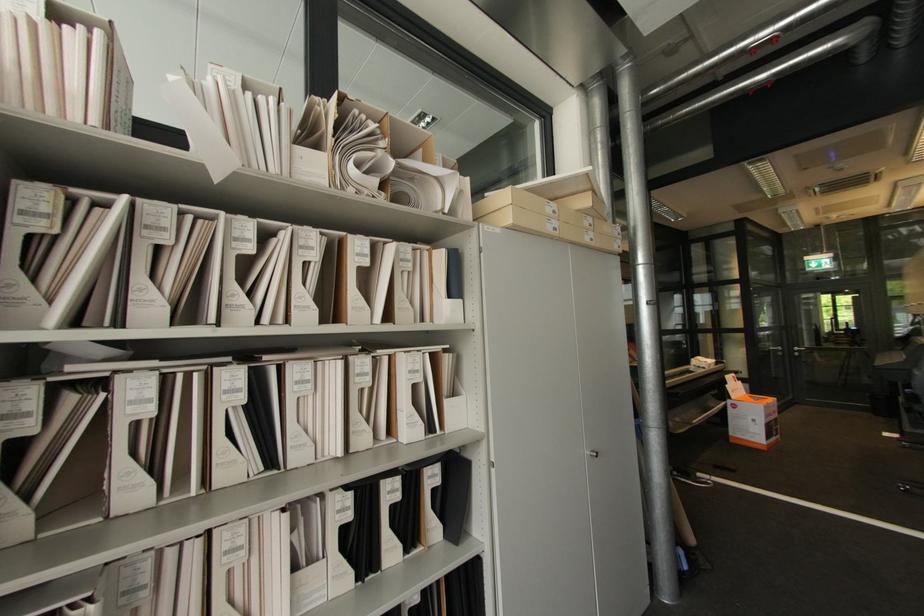
What do you see at coordinates (804, 352) in the screenshot? I see `the glass door handle` at bounding box center [804, 352].